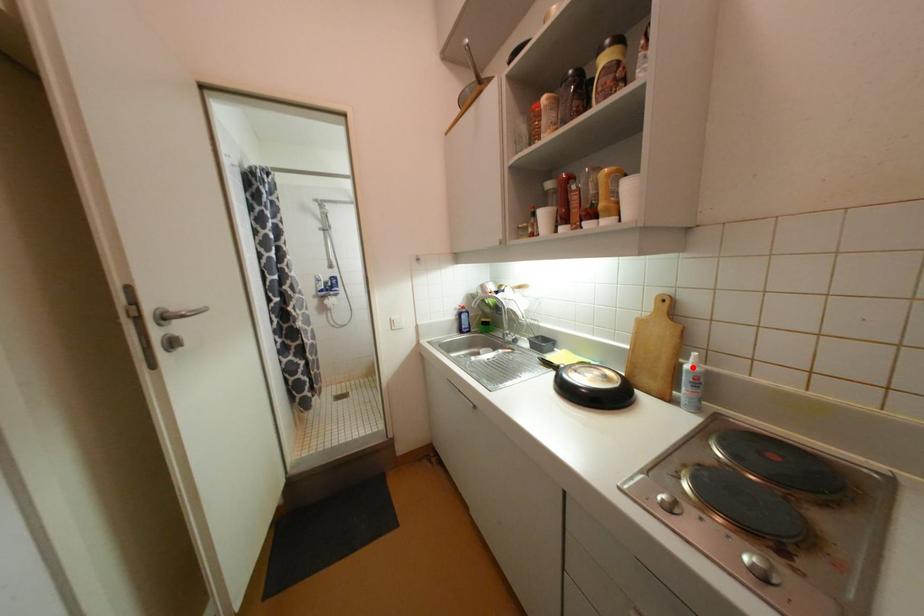
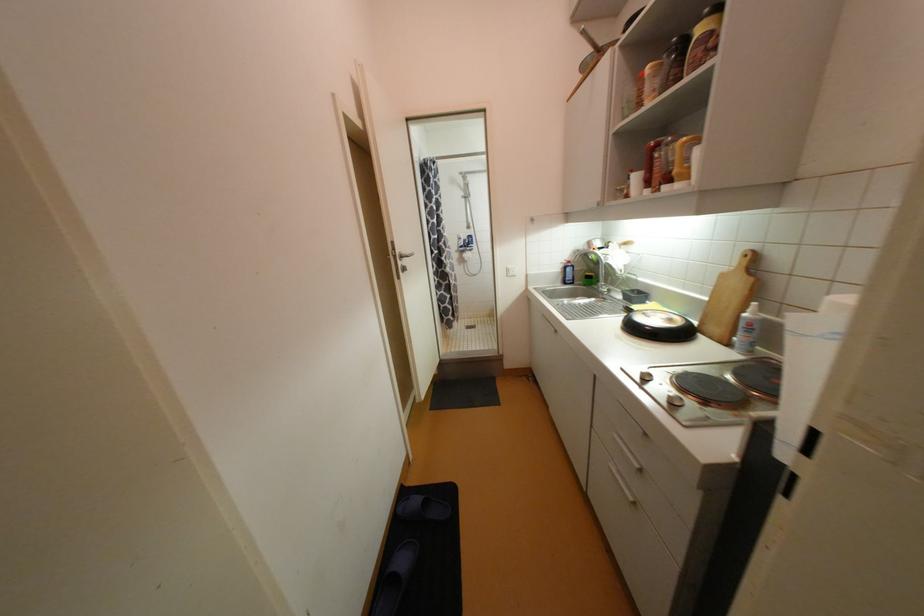
Find the pixel in the second image that matches the highlighted location in the first image.

(750, 315)